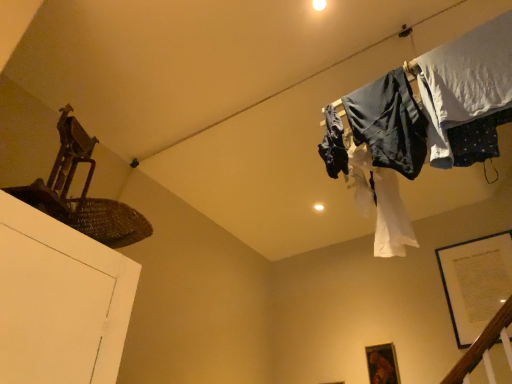
Question: Are white fabric at upper right, the 3th clothing in the left-to-right sequence, and dark blue fabric at upper right, acting as the first clothing starting from the left, located far from each other?

Choices:
 (A) yes
 (B) no

Answer: (B)

Question: Considering the relative sizes of white fabric at upper right, the 3th clothing in the left-to-right sequence, and dark blue fabric at upper right, acting as the first clothing starting from the left, in the image provided, is white fabric at upper right, the 3th clothing in the left-to-right sequence, thinner than dark blue fabric at upper right, acting as the first clothing starting from the left,?

Choices:
 (A) yes
 (B) no

Answer: (B)

Question: From a real-world perspective, is white fabric at upper right, arranged as the first clothing when viewed from the right, over dark blue fabric at upper right, which ranks as the 3th clothing in right-to-left order?

Choices:
 (A) yes
 (B) no

Answer: (B)

Question: Is white fabric at upper right, the 3th clothing in the left-to-right sequence, not within dark blue fabric at upper right, which ranks as the 3th clothing in right-to-left order?

Choices:
 (A) no
 (B) yes

Answer: (B)

Question: Considering the relative positions of white fabric at upper right, the 3th clothing in the left-to-right sequence, and dark blue fabric at upper right, which ranks as the 3th clothing in right-to-left order, in the image provided, is white fabric at upper right, the 3th clothing in the left-to-right sequence, to the left of dark blue fabric at upper right, which ranks as the 3th clothing in right-to-left order, from the viewer's perspective?

Choices:
 (A) yes
 (B) no

Answer: (B)

Question: Does white fabric at upper right, the 3th clothing in the left-to-right sequence, have a greater height compared to dark blue fabric at upper right, which ranks as the 3th clothing in right-to-left order?

Choices:
 (A) yes
 (B) no

Answer: (A)

Question: From the image's perspective, is wooden frame at lower right on dark blue fabric at upper right, acting as the first clothing starting from the left?

Choices:
 (A) no
 (B) yes

Answer: (A)

Question: Is wooden frame at lower right in front of dark blue fabric at upper right, acting as the first clothing starting from the left?

Choices:
 (A) no
 (B) yes

Answer: (A)

Question: Does wooden frame at lower right have a greater width compared to dark blue fabric at upper right, acting as the first clothing starting from the left?

Choices:
 (A) no
 (B) yes

Answer: (A)

Question: From a real-world perspective, is wooden frame at lower right located beneath dark blue fabric at upper right, acting as the first clothing starting from the left?

Choices:
 (A) no
 (B) yes

Answer: (B)

Question: From the image's perspective, does wooden frame at lower right appear lower than dark blue fabric at upper right, acting as the first clothing starting from the left?

Choices:
 (A) yes
 (B) no

Answer: (A)

Question: Does wooden frame at lower right have a smaller size compared to dark blue fabric at upper right, acting as the first clothing starting from the left?

Choices:
 (A) yes
 (B) no

Answer: (A)

Question: Does wooden frame at lower right have a larger size compared to white fabric at upper right, arranged as the first clothing when viewed from the right?

Choices:
 (A) no
 (B) yes

Answer: (A)